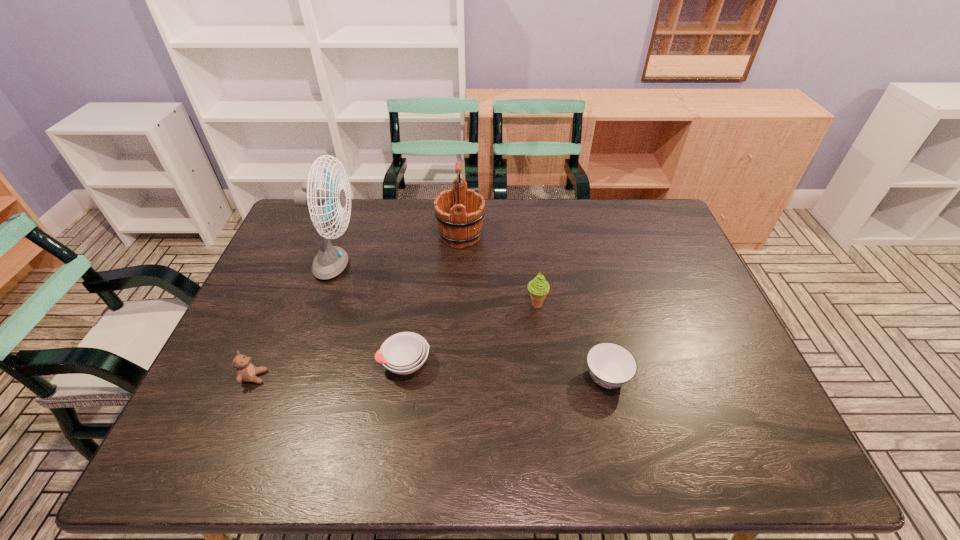
Image resolution: width=960 pixels, height=540 pixels. I want to click on vacant space at the left edge of the desktop, so click(x=239, y=338).

Identify the location of free spot at the right edge of the desktop. (650, 291).

Locate an element on the screen. The width and height of the screenshot is (960, 540). free spot at the near left corner of the desktop is located at coordinates tap(223, 468).

This screenshot has height=540, width=960. In the image, there is a desktop. Find the location of `free region at the far right corner`. free region at the far right corner is located at coordinates (663, 211).

The height and width of the screenshot is (540, 960). In the image, there is a desktop. Identify the location of vacant space at the near right corner. (742, 460).

Identify the location of free space between the rightmost object and the second object from right to left. (571, 341).

You are a GUI agent. You are given a task and a screenshot of the screen. Output one action in this format:
    pyautogui.click(x=<x>, y=<y>)
    Task: Click on the vacant point located between the fourth shortest object and the right soup bowl
    The width and height of the screenshot is (960, 540).
    Given the screenshot: What is the action you would take?
    pyautogui.click(x=571, y=341)

The height and width of the screenshot is (540, 960). In order to click on vacant space that's between the fifth shortest object and the left soup bowl in this screenshot , I will do `click(433, 300)`.

Image resolution: width=960 pixels, height=540 pixels. I want to click on vacant region between the rightmost object and the left soup bowl, so click(x=506, y=370).

Locate an element on the screen. The height and width of the screenshot is (540, 960). free space that is in between the fourth shortest object and the second object from left to right is located at coordinates (437, 286).